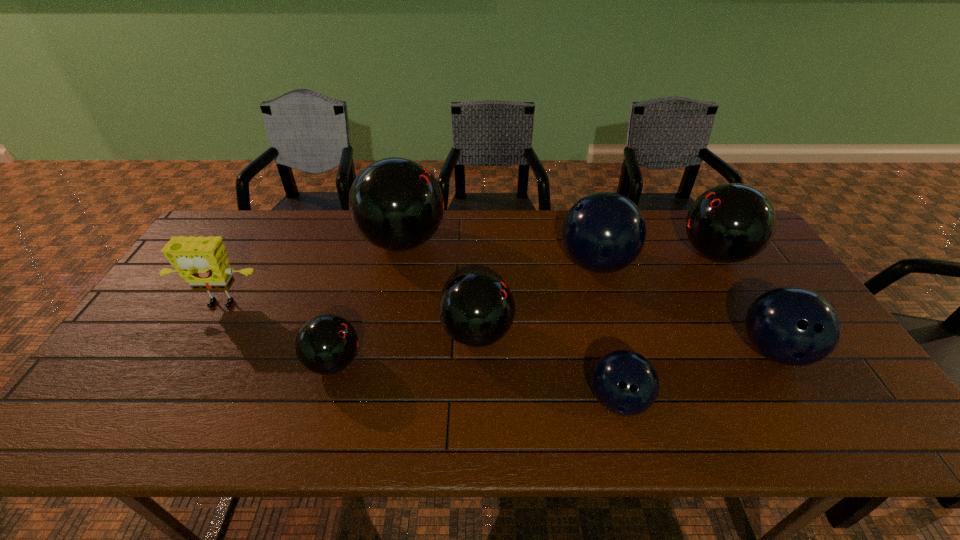
Image resolution: width=960 pixels, height=540 pixels. What are the coordinates of `free spot between the second smallest black bowling ball and the farthest blue bowling ball` in the screenshot? It's located at (537, 299).

The width and height of the screenshot is (960, 540). I want to click on free spot between the rightmost black bowling ball and the smallest black bowling ball, so 525,308.

Find the location of a particular element. The height and width of the screenshot is (540, 960). free space between the smallest black bowling ball and the biggest black bowling ball is located at coordinates (369, 302).

Find the location of a particular element. The width and height of the screenshot is (960, 540). vacant region between the biggest blue bowling ball and the yellow sponge is located at coordinates click(408, 285).

This screenshot has width=960, height=540. In order to click on vacant space in between the rightmost black bowling ball and the smallest blue bowling ball in this screenshot , I will do `click(666, 327)`.

You are a GUI agent. You are given a task and a screenshot of the screen. Output one action in this format:
    pyautogui.click(x=<x>, y=<y>)
    Task: Click on the free area in between the third smallest black bowling ball and the rightmost blue bowling ball
    This screenshot has width=960, height=540.
    Given the screenshot: What is the action you would take?
    pyautogui.click(x=745, y=302)

Find the location of a particular element. The image size is (960, 540). blank region between the biggest blue bowling ball and the smallest blue bowling ball is located at coordinates (607, 332).

Identify which object is the third closest to the smallest black bowling ball. Please provide its 2D coordinates. Your answer should be formatted as a tuple, i.e. [(x, y)], where the tuple contains the x and y coordinates of a point satisfying the conditions above.

[(396, 204)]

Image resolution: width=960 pixels, height=540 pixels. What are the coordinates of `the closest object to the smallest blue bowling ball` in the screenshot? It's located at pos(476,309).

Locate which bowling ball ranks third in proximity to the third smallest black bowling ball. Please provide its 2D coordinates. Your answer should be formatted as a tuple, i.e. [(x, y)], where the tuple contains the x and y coordinates of a point satisfying the conditions above.

[(624, 382)]